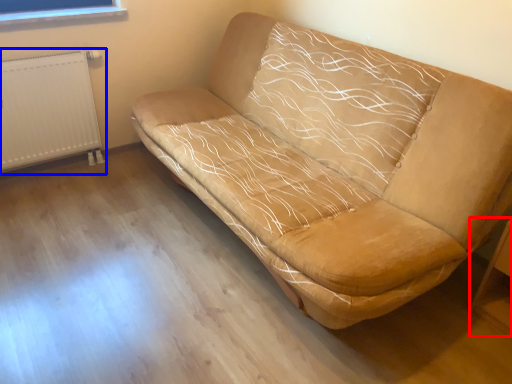
Question: Which object is closer to the camera taking this photo, table (highlighted by a red box) or radiator (highlighted by a blue box)?

Choices:
 (A) table
 (B) radiator

Answer: (A)